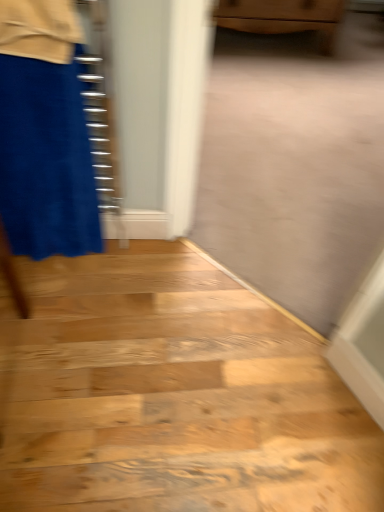
Question: Is velvet blue miniskirt at left facing towards wooden floor at lower left?

Choices:
 (A) no
 (B) yes

Answer: (A)

Question: Is velvet blue miniskirt at left shorter than wooden floor at lower left?

Choices:
 (A) no
 (B) yes

Answer: (A)

Question: Is wooden floor at lower left surrounded by velvet blue miniskirt at left?

Choices:
 (A) yes
 (B) no

Answer: (B)

Question: Is velvet blue miniskirt at left not inside wooden floor at lower left?

Choices:
 (A) no
 (B) yes

Answer: (B)

Question: From the image's perspective, is velvet blue miniskirt at left located above wooden floor at lower left?

Choices:
 (A) no
 (B) yes

Answer: (B)

Question: In terms of size, does wooden floor at lower left appear bigger or smaller than wooden cabinet at upper center?

Choices:
 (A) small
 (B) big

Answer: (A)

Question: In the image, is wooden floor at lower left on the left side or the right side of wooden cabinet at upper center?

Choices:
 (A) left
 (B) right

Answer: (A)

Question: From the image's perspective, is wooden floor at lower left positioned above or below wooden cabinet at upper center?

Choices:
 (A) below
 (B) above

Answer: (A)

Question: In terms of height, does wooden floor at lower left look taller or shorter compared to wooden cabinet at upper center?

Choices:
 (A) tall
 (B) short

Answer: (B)

Question: Based on their positions, is velvet blue miniskirt at left located to the left or right of wooden cabinet at upper center?

Choices:
 (A) right
 (B) left

Answer: (B)

Question: From the image's perspective, is velvet blue miniskirt at left positioned above or below wooden cabinet at upper center?

Choices:
 (A) above
 (B) below

Answer: (B)

Question: Is velvet blue miniskirt at left inside or outside of wooden cabinet at upper center?

Choices:
 (A) outside
 (B) inside

Answer: (A)

Question: Considering their positions, is velvet blue miniskirt at left located in front of or behind wooden cabinet at upper center?

Choices:
 (A) behind
 (B) front

Answer: (B)

Question: In terms of height, does wooden floor at lower left look taller or shorter compared to velvet blue miniskirt at left?

Choices:
 (A) tall
 (B) short

Answer: (B)

Question: From a real-world perspective, is wooden floor at lower left positioned above or below velvet blue miniskirt at left?

Choices:
 (A) above
 (B) below

Answer: (B)